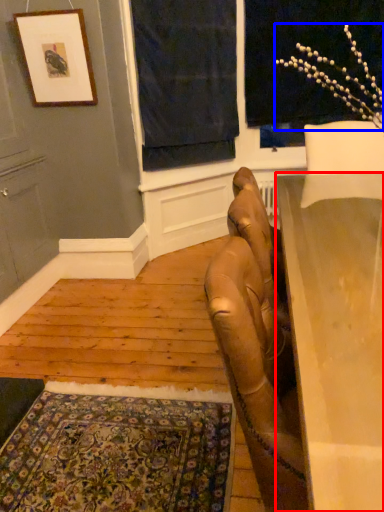
Question: Which object appears farthest to the camera in this image, table (highlighted by a red box) or flower (highlighted by a blue box)?

Choices:
 (A) table
 (B) flower

Answer: (B)